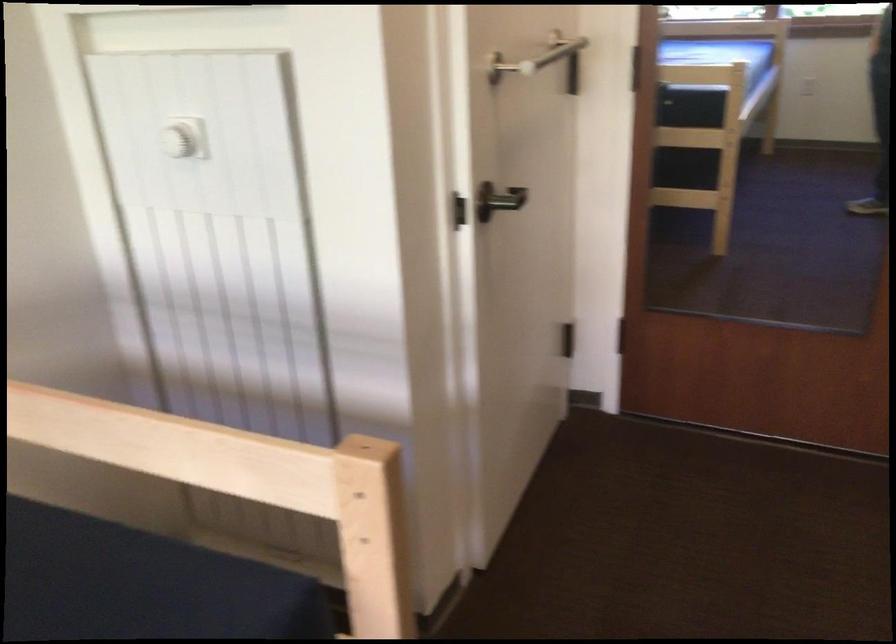
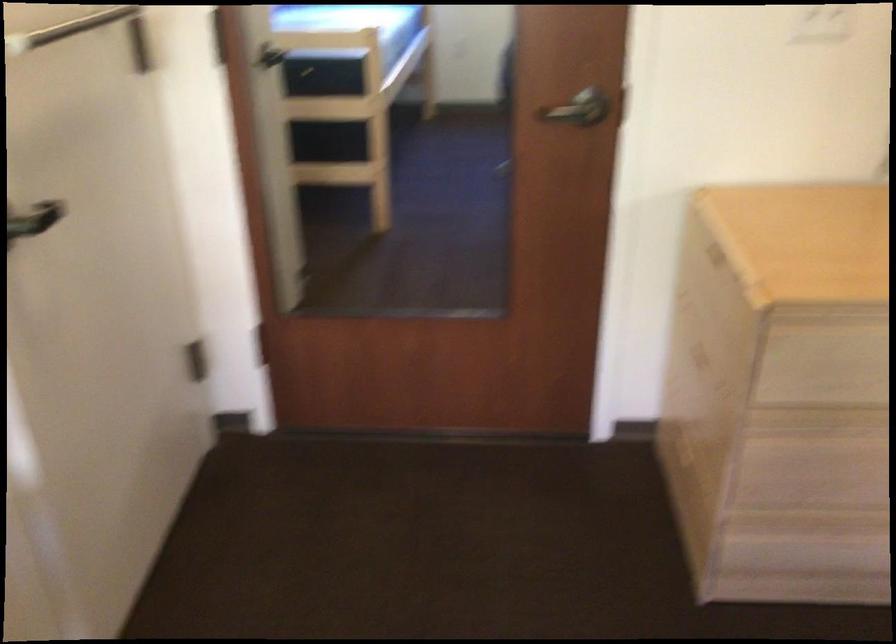
The point at (564, 335) is marked in the first image. Where is the corresponding point in the second image?

(195, 357)